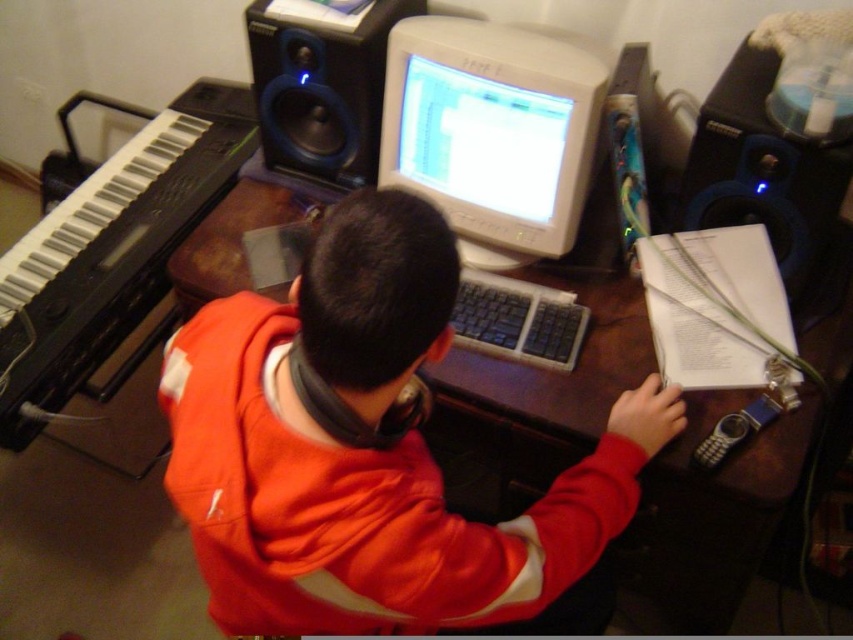
Question: Which point appears closest to the camera in this image?

Choices:
 (A) (531, 307)
 (B) (692, 168)

Answer: (B)

Question: Estimate the real-world distances between objects in this image. Which object is farther from the black plastic keyboard at center?

Choices:
 (A) orange fleece jacket at center
 (B) blue plastic speaker at right
 (C) white glossy monitor at center
 (D) black plastic piano at left

Answer: (D)

Question: Can you confirm if orange fleece jacket at center is smaller than black plastic keyboard at center?

Choices:
 (A) yes
 (B) no

Answer: (B)

Question: In this image, where is white glossy monitor at center located relative to blue plastic speaker at right?

Choices:
 (A) above
 (B) below

Answer: (A)

Question: Which object is closer to the camera taking this photo?

Choices:
 (A) blue plastic speaker at right
 (B) white glossy monitor at center
 (C) black plastic piano at left
 (D) matte black speaker at upper center

Answer: (A)

Question: Can you confirm if orange fleece jacket at center is thinner than black plastic piano at left?

Choices:
 (A) yes
 (B) no

Answer: (B)